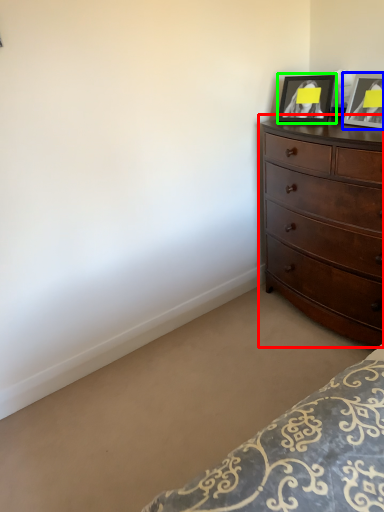
Question: Based on their relative distances, which object is nearer to chest of drawers (highlighted by a red box)? Choose from picture frame (highlighted by a blue box) and picture frame (highlighted by a green box).

Choices:
 (A) picture frame
 (B) picture frame

Answer: (A)